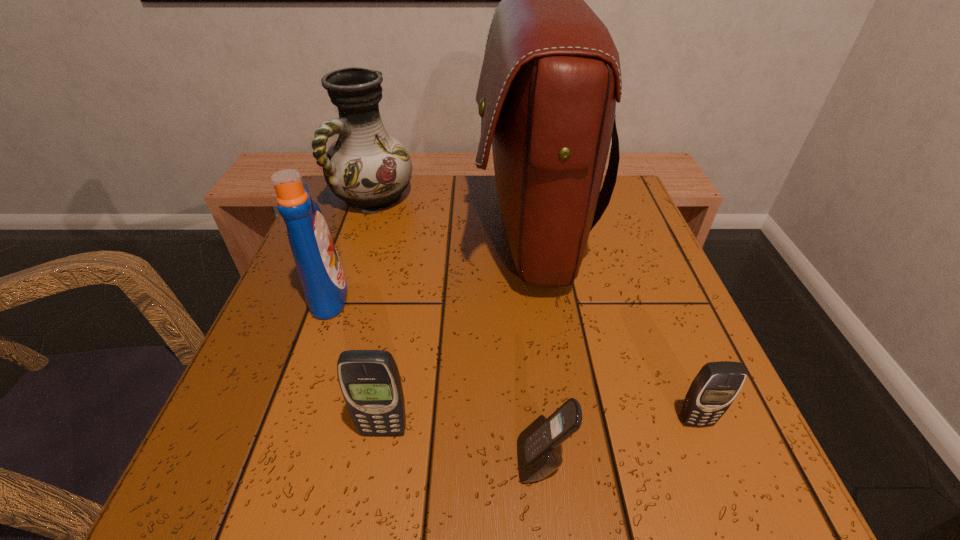
Find the location of a particular element. Image resolution: width=960 pixels, height=540 pixels. free point located on the open flap of the satchel is located at coordinates (417, 234).

In order to click on vacant space located on the front of the vase in this screenshot , I will do `click(342, 293)`.

This screenshot has height=540, width=960. I want to click on vacant space located 0.060m on the label of the detergent, so click(x=381, y=293).

Locate an element on the screen. vacant space located on the screen of the tallest cellular telephone is located at coordinates (372, 504).

This screenshot has height=540, width=960. Identify the location of blank area located on the front face of the rightmost cellular telephone. (728, 502).

I want to click on free point located on the front-facing side of the nearest cellular telephone, so click(459, 461).

This screenshot has height=540, width=960. I want to click on free space located on the front-facing side of the nearest cellular telephone, so click(x=311, y=461).

The width and height of the screenshot is (960, 540). Find the location of `free space located on the front-facing side of the nearest cellular telephone`. free space located on the front-facing side of the nearest cellular telephone is located at coordinates (237, 461).

This screenshot has width=960, height=540. In order to click on satchel positioned at the far edge in this screenshot , I will do `click(550, 78)`.

Where is `vase located at the far edge`? The height and width of the screenshot is (540, 960). vase located at the far edge is located at coordinates [x=368, y=169].